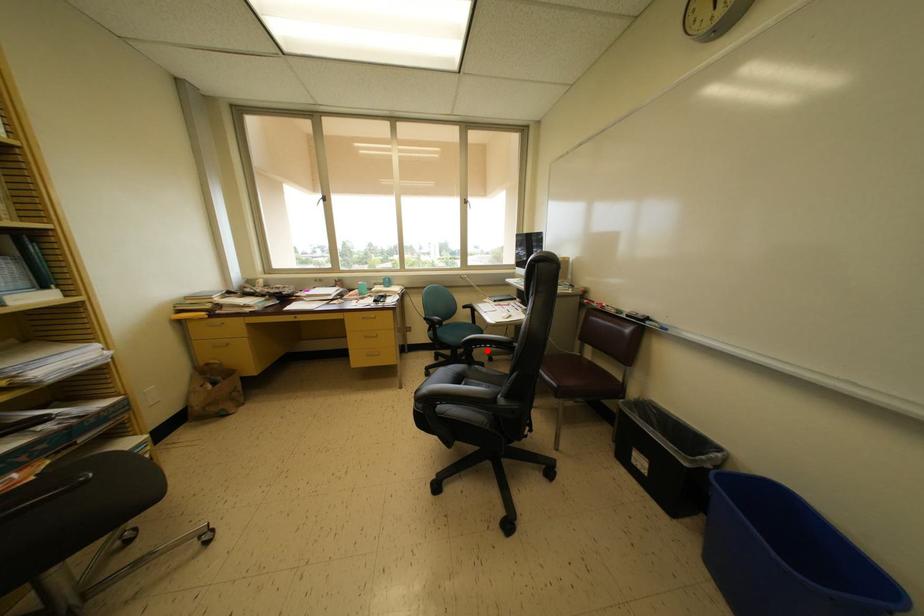
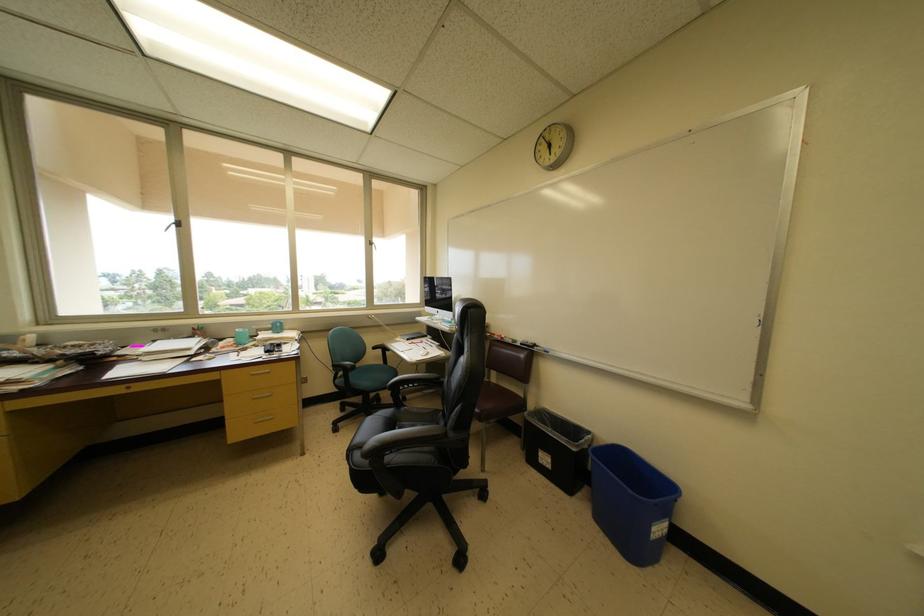
Where in the second image is the point corresponding to the highlighted location from the first image?

(415, 391)